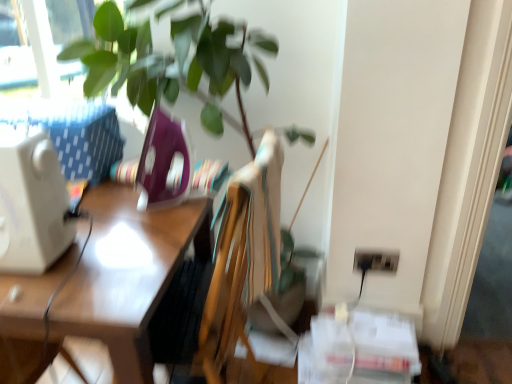
Find the location of a particular element. This screenshot has width=512, height=384. vacant area that lies in front of white plastic desktop computer at left is located at coordinates (32, 288).